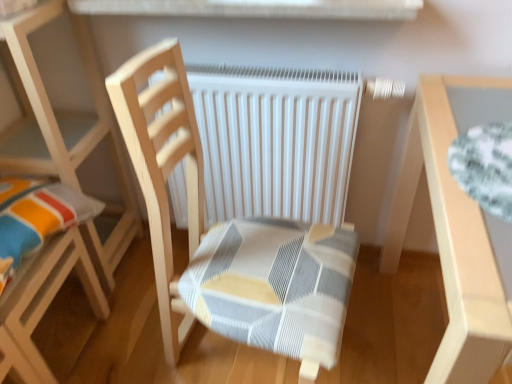
Locate an element on the screen. wooden chair with striped cushion at center, which ranks as the first chair in right-to-left order is located at coordinates (246, 198).

Describe the element at coordinates (255, 8) in the screenshot. I see `white smooth window sill at upper center` at that location.

This screenshot has height=384, width=512. Find the location of `light wood table at right`. light wood table at right is located at coordinates (455, 225).

In order to click on white matte radiator at center in this screenshot , I will do `click(275, 140)`.

Measure the distance between point (216, 117) and camera.

Point (216, 117) is 4.12 feet from camera.

Where is `wooden chair at left, the first chair viewed from the left`? The height and width of the screenshot is (384, 512). wooden chair at left, the first chair viewed from the left is located at coordinates (62, 174).

Find the location of a particular element. The height and width of the screenshot is (384, 512). wooden chair with striped cushion at center, which is counted as the second chair, starting from the left is located at coordinates (246, 198).

From the image's perspective, between wooden chair at left, the first chair viewed from the left, and light wood table at right, which one is located above?

wooden chair at left, the first chair viewed from the left, is shown above in the image.

Does wooden chair at left, the 2th chair in the right-to-left sequence, lie in front of light wood table at right?

No, the depth of wooden chair at left, the 2th chair in the right-to-left sequence, is greater than that of light wood table at right.

Is wooden chair at left, the first chair viewed from the left, in contact with light wood table at right?

No.

Considering the positions of objects white smooth window sill at upper center and wooden chair with striped cushion at center, which ranks as the first chair in right-to-left order, in the image provided, who is more to the left, white smooth window sill at upper center or wooden chair with striped cushion at center, which ranks as the first chair in right-to-left order,?

Positioned to the left is white smooth window sill at upper center.

Considering the sizes of objects white smooth window sill at upper center and wooden chair with striped cushion at center, which ranks as the first chair in right-to-left order, in the image provided, who is taller, white smooth window sill at upper center or wooden chair with striped cushion at center, which ranks as the first chair in right-to-left order,?

Standing taller between the two is wooden chair with striped cushion at center, which ranks as the first chair in right-to-left order.

Which is farther, [201,10] or [250,137]?

The point [250,137] is behind.

In the scene shown: Is there a large distance between white smooth window sill at upper center and wooden chair with striped cushion at center, which is counted as the second chair, starting from the left?

Actually, white smooth window sill at upper center and wooden chair with striped cushion at center, which is counted as the second chair, starting from the left, are a little close together.

From the image's perspective, relative to white smooth window sill at upper center, is wooden chair at left, the first chair viewed from the left, above or below?

wooden chair at left, the first chair viewed from the left, is below white smooth window sill at upper center.

Which point is more forward, (58, 240) or (91, 2)?

The point (91, 2) is in front.

Does wooden chair at left, the first chair viewed from the left, have a lesser height compared to white smooth window sill at upper center?

No, wooden chair at left, the first chair viewed from the left, is not shorter than white smooth window sill at upper center.

Who is taller, white matte radiator at center or light wood table at right?

light wood table at right is taller.

From the image's perspective, does white matte radiator at center appear higher than light wood table at right?

Yes.

Is white matte radiator at center oriented away from light wood table at right?

No, white matte radiator at center is not facing the opposite direction of light wood table at right.

Could you tell me if light wood table at right is turned towards white smooth window sill at upper center?

No, light wood table at right is not turned towards white smooth window sill at upper center.

Is light wood table at right in front of white smooth window sill at upper center?

Yes, light wood table at right is closer to the viewer.

Considering the relative sizes of white matte radiator at center and wooden chair with striped cushion at center, which is counted as the second chair, starting from the left, in the image provided, is white matte radiator at center thinner than wooden chair with striped cushion at center, which is counted as the second chair, starting from the left,?

Yes.

From a real-world perspective, is white matte radiator at center positioned above or below wooden chair with striped cushion at center, which is counted as the second chair, starting from the left?

From a real-world perspective, white matte radiator at center is physically below wooden chair with striped cushion at center, which is counted as the second chair, starting from the left.

Which object is positioned more to the left, white matte radiator at center or wooden chair with striped cushion at center, which is counted as the second chair, starting from the left?

wooden chair with striped cushion at center, which is counted as the second chair, starting from the left.

Between white matte radiator at center and wooden chair with striped cushion at center, which is counted as the second chair, starting from the left, which one has larger size?

wooden chair with striped cushion at center, which is counted as the second chair, starting from the left, is bigger.

Is white matte radiator at center to the right of white smooth window sill at upper center from the viewer's perspective?

Correct, you'll find white matte radiator at center to the right of white smooth window sill at upper center.

What are the coordinates of `window sill on the left of the white matte radiator at center` in the screenshot? It's located at (255, 8).

From the image's perspective, is white matte radiator at center under white smooth window sill at upper center?

Yes, from the image's perspective, white matte radiator at center is beneath white smooth window sill at upper center.

Could you tell me if white matte radiator at center is facing white smooth window sill at upper center?

No.

Find the location of `table on the right of wooden chair at left, the first chair viewed from the left`. table on the right of wooden chair at left, the first chair viewed from the left is located at coordinates (455, 225).

Locate an element on the screen. This screenshot has width=512, height=384. window sill above the wooden chair with striped cushion at center, which is counted as the second chair, starting from the left (from a real-world perspective) is located at coordinates (255, 8).

Estimate the real-world distances between objects in this image. Which object is closer to light wood table at right, wooden chair with striped cushion at center, which is counted as the second chair, starting from the left, or white matte radiator at center?

white matte radiator at center is closer to light wood table at right.

From the image, which object appears to be farther from wooden chair at left, the first chair viewed from the left, white smooth window sill at upper center or white matte radiator at center?

white smooth window sill at upper center.

Which object lies nearer to the anchor point white matte radiator at center, wooden chair with striped cushion at center, which is counted as the second chair, starting from the left, or wooden chair at left, the first chair viewed from the left?

Among the two, wooden chair with striped cushion at center, which is counted as the second chair, starting from the left, is located nearer to white matte radiator at center.

From the image, which object appears to be farther from white matte radiator at center, white smooth window sill at upper center or light wood table at right?

Among the two, light wood table at right is located further to white matte radiator at center.

When comparing their distances from white smooth window sill at upper center, does wooden chair with striped cushion at center, which ranks as the first chair in right-to-left order, or white matte radiator at center seem closer?

The object closer to white smooth window sill at upper center is white matte radiator at center.

Estimate the real-world distances between objects in this image. Which object is further from white smooth window sill at upper center, wooden chair with striped cushion at center, which ranks as the first chair in right-to-left order, or wooden chair at left, the 2th chair in the right-to-left sequence?

wooden chair at left, the 2th chair in the right-to-left sequence, is positioned further to the anchor white smooth window sill at upper center.

Looking at the image, which one is located further to white matte radiator at center, light wood table at right or wooden chair with striped cushion at center, which ranks as the first chair in right-to-left order?

light wood table at right is positioned further to the anchor white matte radiator at center.

When comparing their distances from wooden chair at left, the first chair viewed from the left, does white smooth window sill at upper center or wooden chair with striped cushion at center, which is counted as the second chair, starting from the left, seem closer?

Based on the image, wooden chair with striped cushion at center, which is counted as the second chair, starting from the left, appears to be nearer to wooden chair at left, the first chair viewed from the left.

In order to click on window sill between wooden chair at left, the 2th chair in the right-to-left sequence, and wooden chair with striped cushion at center, which is counted as the second chair, starting from the left, in the horizontal direction in this screenshot , I will do tap(255, 8).

The width and height of the screenshot is (512, 384). Identify the location of window sill between wooden chair at left, the 2th chair in the right-to-left sequence, and white matte radiator at center. (255, 8).

The image size is (512, 384). I want to click on radiator between white smooth window sill at upper center and light wood table at right in the vertical direction, so click(275, 140).

The height and width of the screenshot is (384, 512). Identify the location of chair situated between wooden chair at left, the first chair viewed from the left, and light wood table at right from left to right. (246, 198).